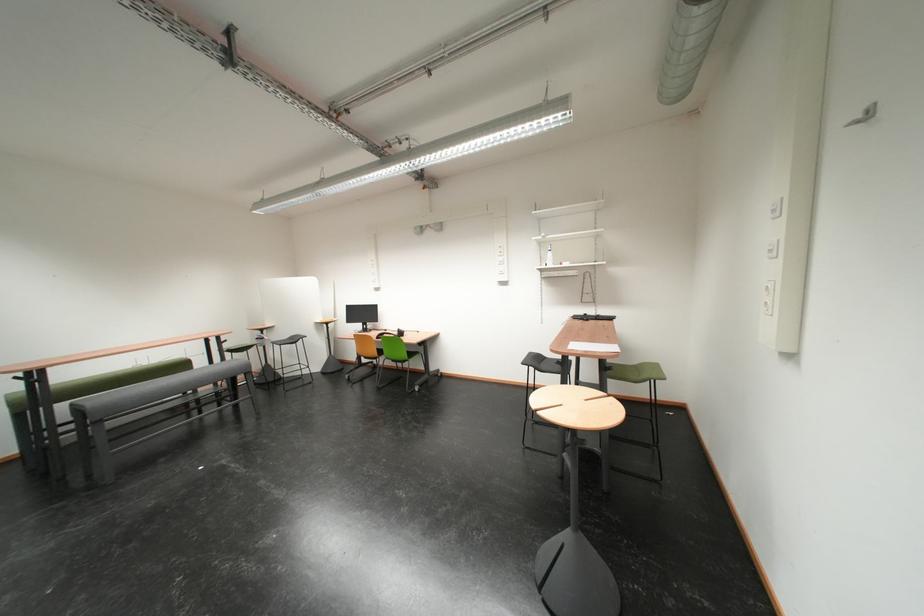
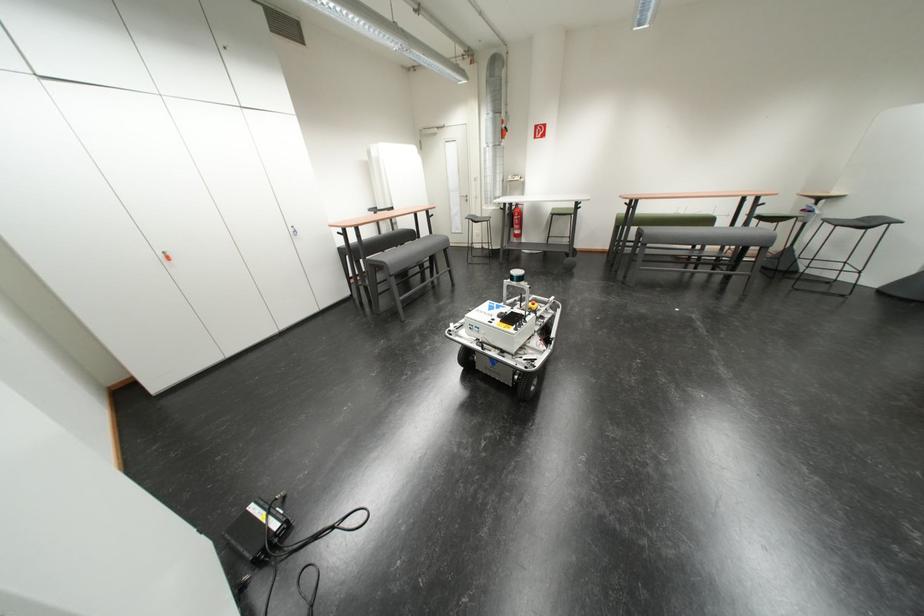
Locate, in the second image, the point that corresponds to point 285,345 in the first image.

(837, 223)